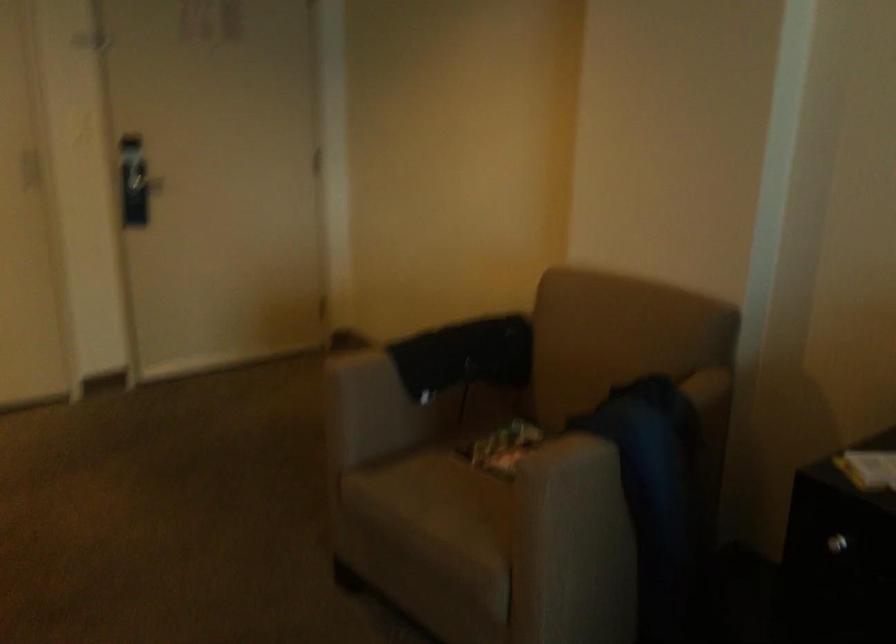
What do you see at coordinates (453, 500) in the screenshot?
I see `the chair sitting surface` at bounding box center [453, 500].